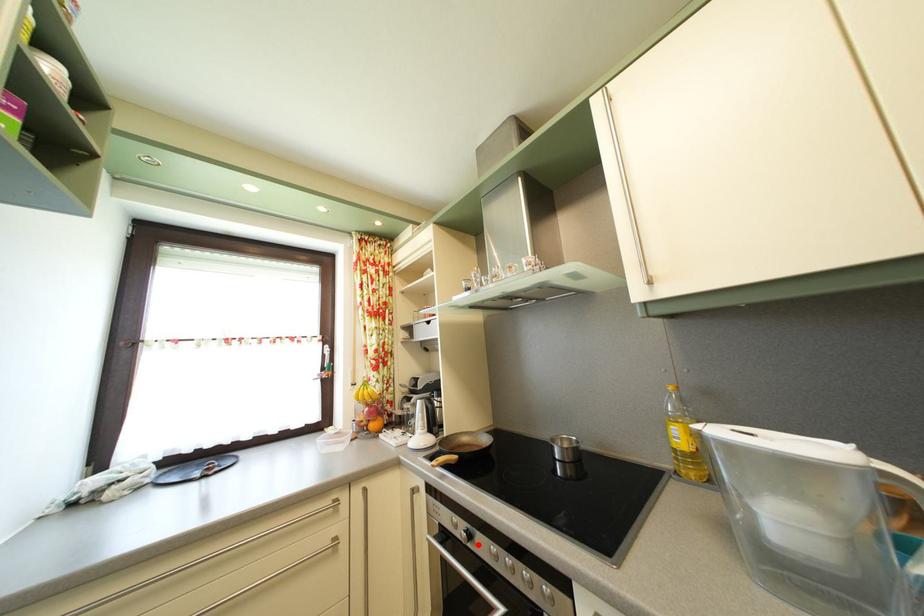
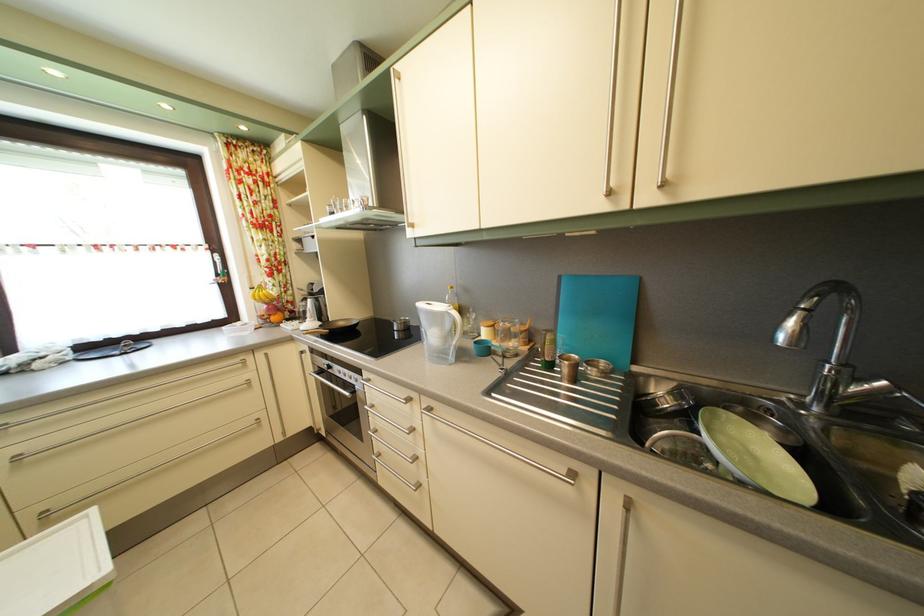
The point at the highlighted location is marked in the first image. Where is the corresponding point in the second image?

(337, 374)